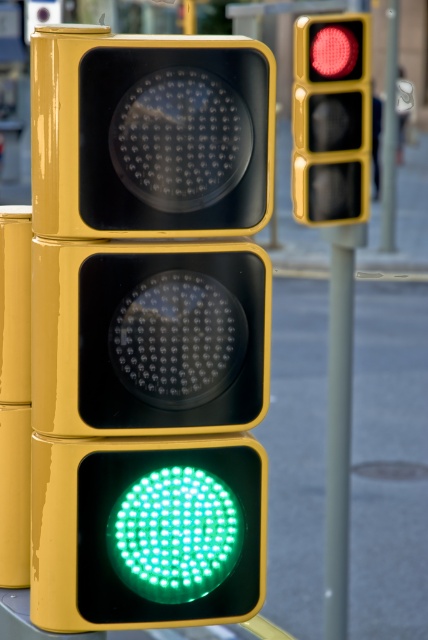
Does point (112, 100) come farther from viewer compared to point (394, 124)?

No.

Is matte yellow traffic light at upper center bigger than metallic pole at upper right?

Incorrect, matte yellow traffic light at upper center is not larger than metallic pole at upper right.

Is point (83, 65) in front of point (394, 45)?

That is True.

Where is `matte yellow traffic light at upper center`? This screenshot has height=640, width=428. matte yellow traffic light at upper center is located at coordinates (149, 134).

Does matte yellow traffic light at upper center have a smaller size compared to green led at bottom?

Actually, matte yellow traffic light at upper center might be larger than green led at bottom.

Which of these two, matte yellow traffic light at upper center or green led at bottom, stands taller?

Standing taller between the two is matte yellow traffic light at upper center.

Who is more forward, (119, 172) or (202, 563)?

Positioned in front is point (119, 172).

You are a GUI agent. You are given a task and a screenshot of the screen. Output one action in this format:
    pyautogui.click(x=<x>, y=<y>)
    Task: Click on the matte yellow traffic light at upper center
    
    Given the screenshot: What is the action you would take?
    pyautogui.click(x=149, y=134)

Who is higher up, matte yellow traffic light at upper center or metallic gray pole at right?

Positioned higher is matte yellow traffic light at upper center.

Measure the distance between matte yellow traffic light at upper center and camera.

matte yellow traffic light at upper center is 5.97 feet away from camera.

Where is `matte yellow traffic light at upper center`? Image resolution: width=428 pixels, height=640 pixels. matte yellow traffic light at upper center is located at coordinates click(x=149, y=134).